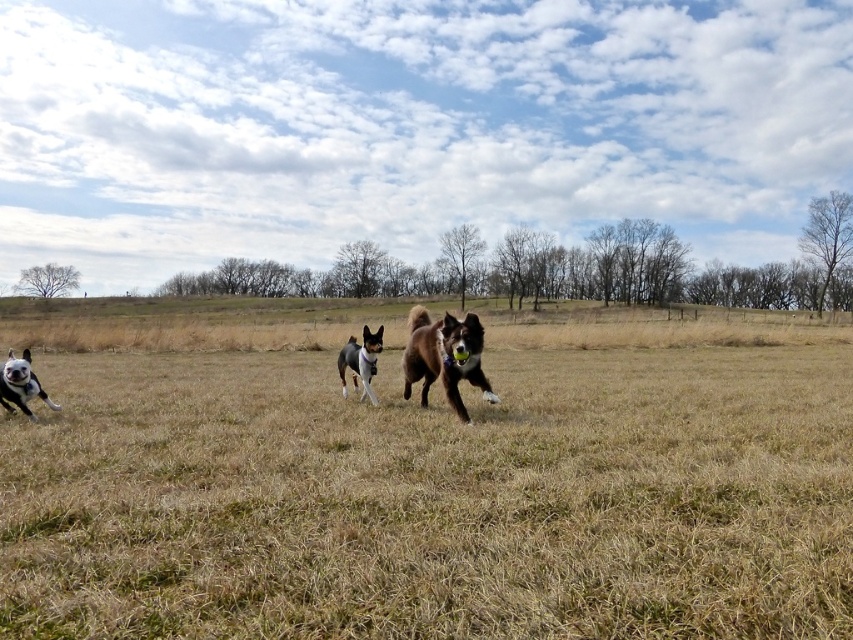
You are a photographer trying to capture a photo of the brown furry dog at center and the white glossy dog at lower left. Based on their positions, which dog is closer to the camera?

The brown furry dog at center is positioned over the white glossy dog at lower left, so it is closer to the camera.

You are standing at the origin point of the coordinate system in this image. You want to walk towards the point at coordinate point (426, 477). What will you encounter there?

You will encounter brown grass at center at coordinate point (426, 477).